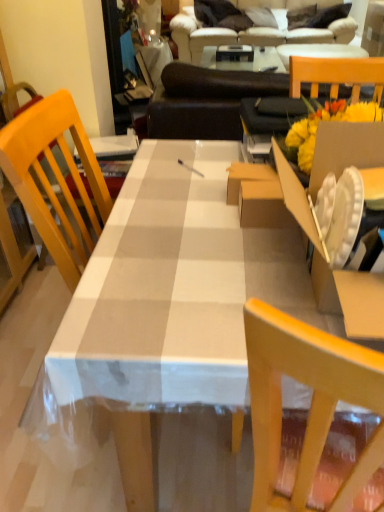
Identify the location of empty space that is ontop of white checkered tablecloth at center (from a real-world perspective). This screenshot has width=384, height=512. (206, 222).